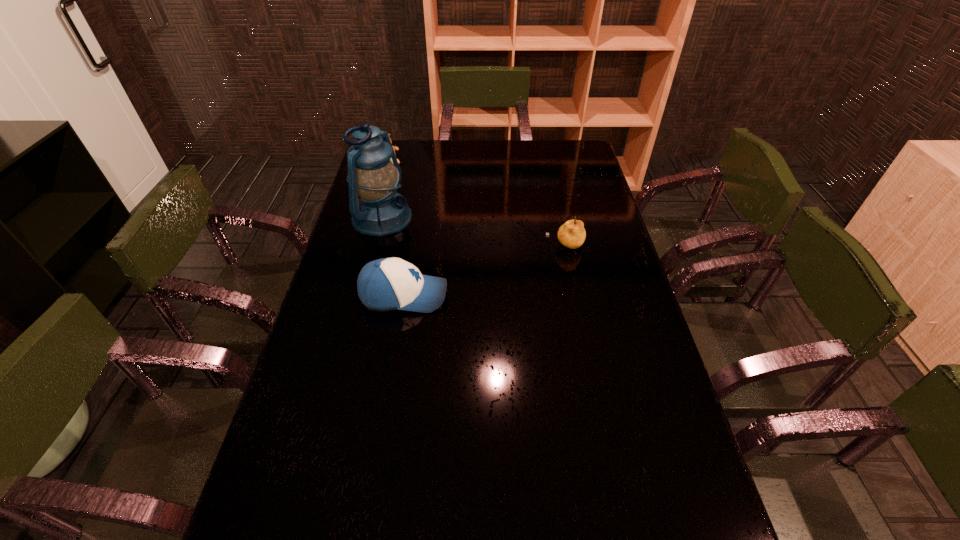
Locate an element on the screen. Image resolution: width=960 pixels, height=540 pixels. object that is the third closest to the baseball cap is located at coordinates (394, 147).

Identify the location of free location that satisfies the following two spatial constraints: 1. on the front side of the farthest object; 2. on the front-facing side of the baseball cap. point(352,295).

The image size is (960, 540). I want to click on blank area in the image that satisfies the following two spatial constraints: 1. on the front side of the tallest object; 2. on the front-facing side of the baseball cap, so click(363, 295).

Image resolution: width=960 pixels, height=540 pixels. In order to click on free space in the image that satisfies the following two spatial constraints: 1. on the front side of the rightmost object; 2. on the right side of the tallest object in this screenshot , I will do `click(375, 246)`.

This screenshot has height=540, width=960. Identify the location of free space that satisfies the following two spatial constraints: 1. on the front side of the teddy bear; 2. on the left side of the lantern. (373, 220).